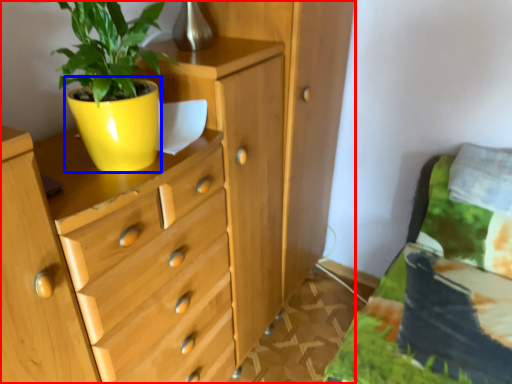
Question: Which of the following is the farthest to the observer, chest of drawers (highlighted by a red box) or flowerpot (highlighted by a blue box)?

Choices:
 (A) chest of drawers
 (B) flowerpot

Answer: (B)